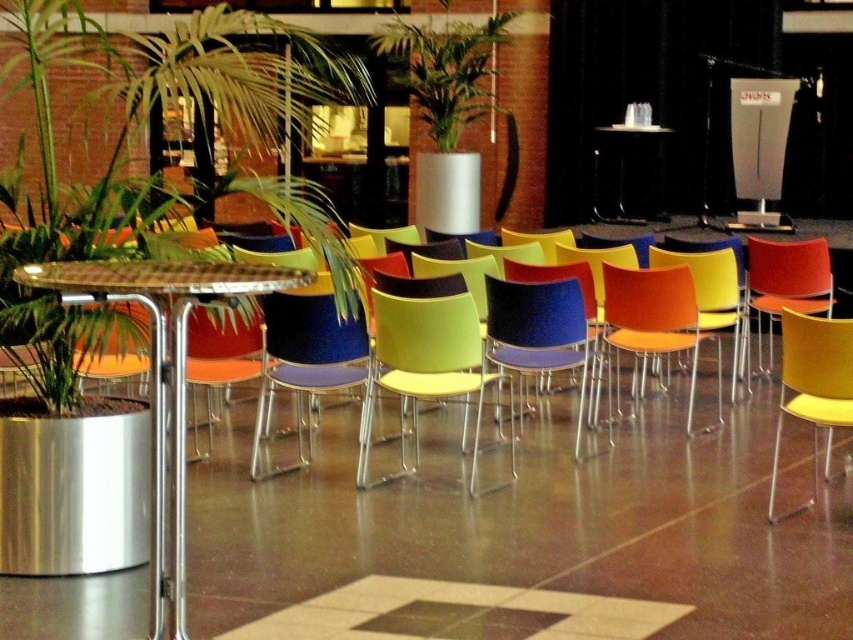
Question: Which is nearer to the yellow plastic swivel chair at right?

Choices:
 (A) green leafy plant at left
 (B) matte plastic chair at center
 (C) yellow plastic chair at center
 (D) green leafy plant at upper center

Answer: (C)

Question: Can you confirm if green leafy plant at left is bigger than green leafy plant at upper center?

Choices:
 (A) no
 (B) yes

Answer: (B)

Question: Can you confirm if matte yellow swivel chair at center is positioned above blue glossy chair at center?

Choices:
 (A) yes
 (B) no

Answer: (B)

Question: Can you confirm if blue glossy chair at center is thinner than black glossy table at center?

Choices:
 (A) no
 (B) yes

Answer: (B)

Question: Which point is farther to the camera?

Choices:
 (A) (747, 285)
 (B) (805, 419)
 (C) (322, 40)

Answer: (A)

Question: Estimate the real-world distances between objects in this image. Which object is farther from the green leafy plant at left?

Choices:
 (A) yellow plastic chair at center
 (B) polished metal table at center
 (C) matte plastic chair at center
 (D) matte yellow swivel chair at center

Answer: (A)